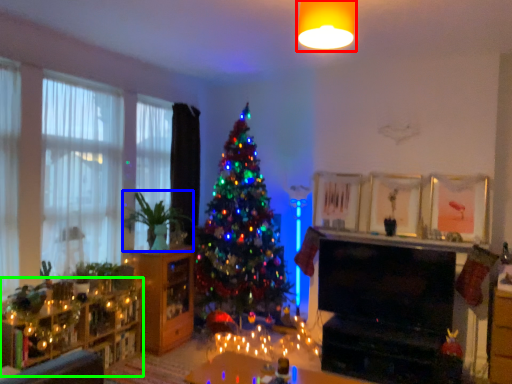
Question: Which is farther away from light fixture (highlighted by a red box)? plant (highlighted by a blue box) or dresser (highlighted by a green box)?

Choices:
 (A) plant
 (B) dresser

Answer: (B)